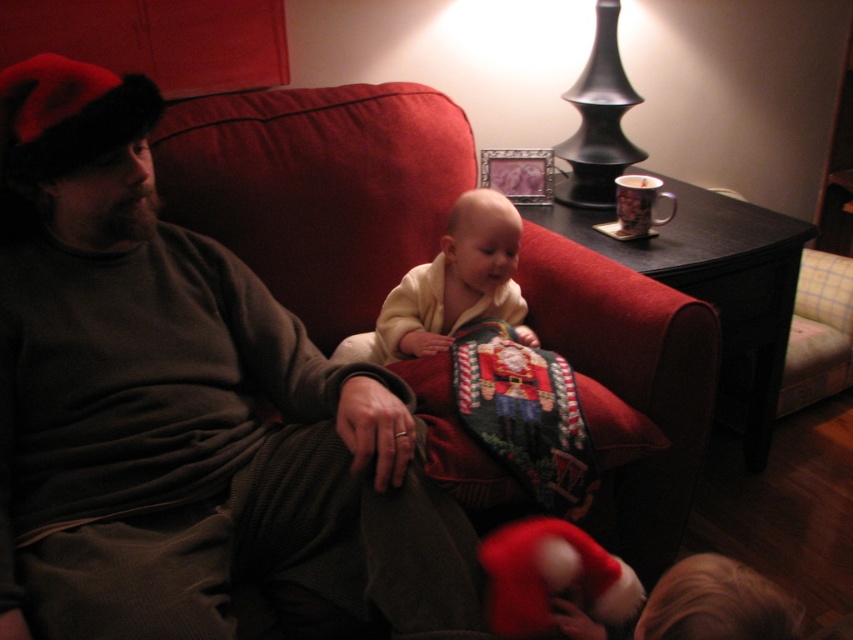
Question: Is dark brown sweater at left closer to the viewer compared to soft cream sweater at center?

Choices:
 (A) no
 (B) yes

Answer: (B)

Question: Among these points, which one is farthest from the camera?

Choices:
 (A) (126, 515)
 (B) (497, 305)
 (C) (592, 372)

Answer: (B)

Question: Estimate the real-world distances between objects in this image. Which object is farther from the dark brown sweater at left?

Choices:
 (A) soft cream sweater at center
 (B) velvet cushion at center

Answer: (A)

Question: Does dark brown sweater at left have a smaller size compared to soft cream sweater at center?

Choices:
 (A) yes
 (B) no

Answer: (B)

Question: Which object is farther from the camera taking this photo?

Choices:
 (A) dark brown sweater at left
 (B) velvet cushion at center

Answer: (B)

Question: Is dark brown sweater at left thinner than soft cream sweater at center?

Choices:
 (A) no
 (B) yes

Answer: (A)